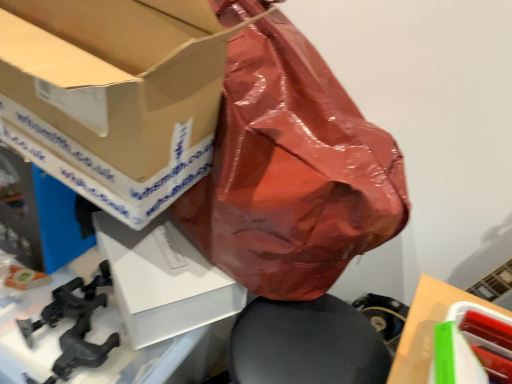
Question: In the image, is white matte cardboard box at lower right positioned in front of or behind white matte box at center, arranged as the second box when viewed from the left?

Choices:
 (A) behind
 (B) front

Answer: (B)

Question: Is point (407, 365) closer or farther from the camera than point (145, 228)?

Choices:
 (A) farther
 (B) closer

Answer: (B)

Question: Based on their relative distances, which object is nearer to the green plastic container at lower right, arranged as the 3th box when viewed from the left?

Choices:
 (A) white matte cardboard box at lower right
 (B) black matte clamp at lower left
 (C) white matte box at center, arranged as the second box when viewed from the left
 (D) matte cardboard box at upper left, acting as the first box starting from the left

Answer: (A)

Question: Which object is positioned farthest from the white matte box at center, arranged as the second box when viewed from the left?

Choices:
 (A) white matte cardboard box at lower right
 (B) black matte clamp at lower left
 (C) green plastic container at lower right, arranged as the 3th box when viewed from the left
 (D) matte cardboard box at upper left, which is the third box from right to left

Answer: (C)